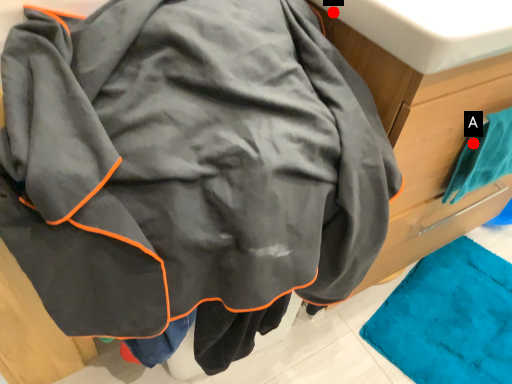
Question: Two points are circled on the image, labeled by A and B beside each circle. Which point is farther from the camera taking this photo?

Choices:
 (A) A is further
 (B) B is further

Answer: (A)